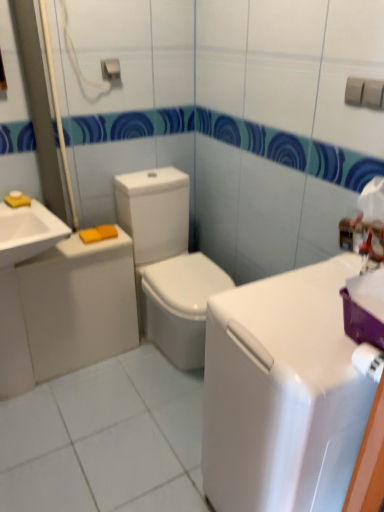
Question: Would you say white glossy toilet at center is to the left or to the right of metallic silver towel bar at upper center in the picture?

Choices:
 (A) left
 (B) right

Answer: (B)

Question: From a real-world perspective, is white glossy toilet at center positioned above or below metallic silver towel bar at upper center?

Choices:
 (A) above
 (B) below

Answer: (B)

Question: Which object is positioned farthest from the white glossy counter top at center?

Choices:
 (A) white glossy toilet at left
 (B) white glossy sink at left
 (C) metallic silver towel bar at upper center
 (D) white glossy toilet at center

Answer: (C)

Question: Which of these objects is positioned farthest from the white glossy counter top at center?

Choices:
 (A) metallic silver towel bar at upper center
 (B) white glossy sink at left
 (C) white glossy toilet at center
 (D) white glossy toilet at left

Answer: (A)